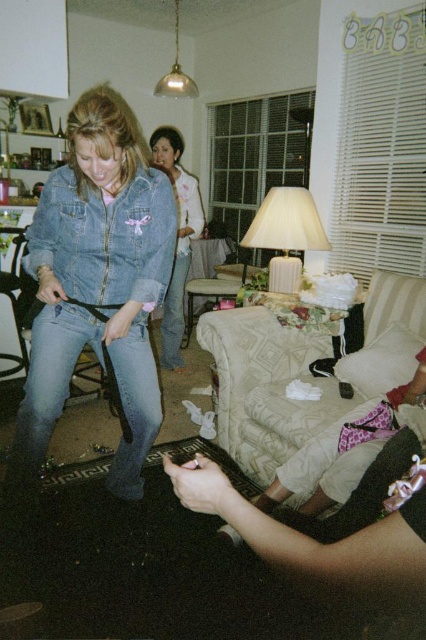
You are a guest at the party and want to sit down. You see the beige fabric couch at lower center and the denim jacket at center. Which object is closer to your current position if you are standing at the entrance facing the room?

The denim jacket at center is closer to your current position because the beige fabric couch at lower center is to the right of it, meaning the denim jacket is between you and the couch.

You are at a party in the living room and want to sit down on the beige fabric couch at lower center. However, there is a denim jacket at lower left in the way. Can you easily access the couch without moving the jacket?

The denim jacket at lower left is in front of the beige fabric couch at lower center, so you cannot easily access the couch without moving the jacket.